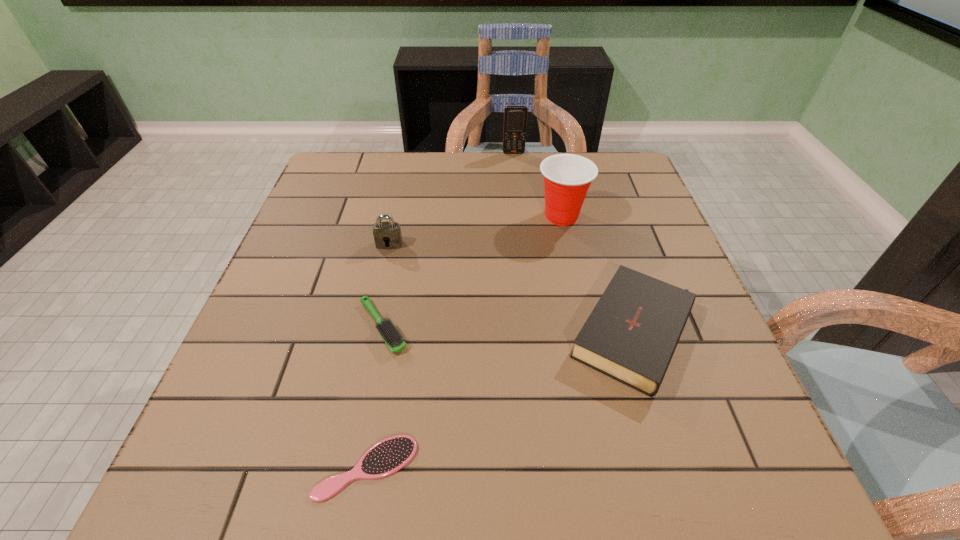
The height and width of the screenshot is (540, 960). Identify the location of vacant region located on the screen of the cellular telephone. (516, 181).

Find the location of a particular element. This screenshot has height=540, width=960. free space located 0.220m on the front of the cup is located at coordinates (580, 300).

The height and width of the screenshot is (540, 960). I want to click on vacant region located at the front of the third tallest object near the keyhole, so pyautogui.click(x=375, y=307).

Identify the location of vacant position located on the back of the Bible. point(590,186).

Identify the location of vacant space located 0.250m on the right of the taller hairbrush. (537, 327).

You are a GUI agent. You are given a task and a screenshot of the screen. Output one action in this format:
    pyautogui.click(x=<x>, y=<y>)
    Task: Click on the vacant space located 0.270m on the back of the shorter hairbrush
    
    Given the screenshot: What is the action you would take?
    pyautogui.click(x=395, y=310)

Identify the location of object that is positioned at the far edge. (515, 116).

At what (x,y) coordinates should I click in order to perform the action: click on object that is positioned at the near edge. Please return your answer as a coordinate pair (x, y). Looking at the image, I should click on (386, 457).

I want to click on object situated at the right edge, so click(x=631, y=335).

You are a GUI agent. You are given a task and a screenshot of the screen. Output one action in this format:
    pyautogui.click(x=<x>, y=<y>)
    Task: Click on the vacant space at the far edge
    
    Given the screenshot: What is the action you would take?
    pyautogui.click(x=449, y=195)